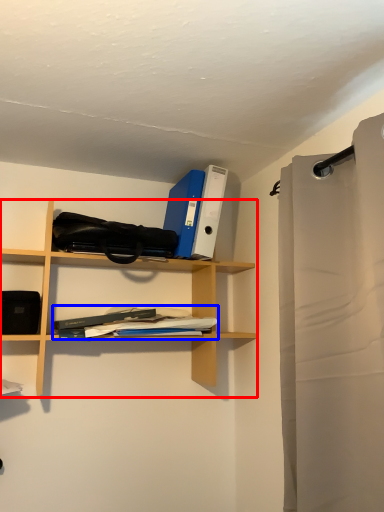
Question: Which object is further to the camera taking this photo, shelf (highlighted by a red box) or book (highlighted by a blue box)?

Choices:
 (A) shelf
 (B) book

Answer: (B)